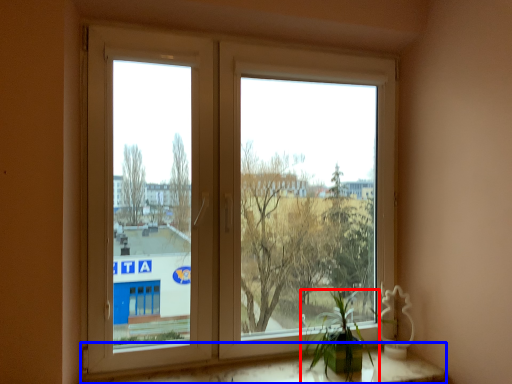
Question: Which object appears farthest to the camera in this image, houseplant (highlighted by a red box) or window sill (highlighted by a blue box)?

Choices:
 (A) houseplant
 (B) window sill

Answer: (A)